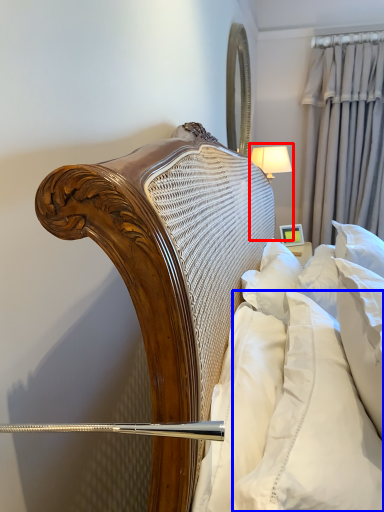
Question: Which of the following is the farthest to the observer, bedside lamp (highlighted by a red box) or pillow (highlighted by a blue box)?

Choices:
 (A) bedside lamp
 (B) pillow

Answer: (A)